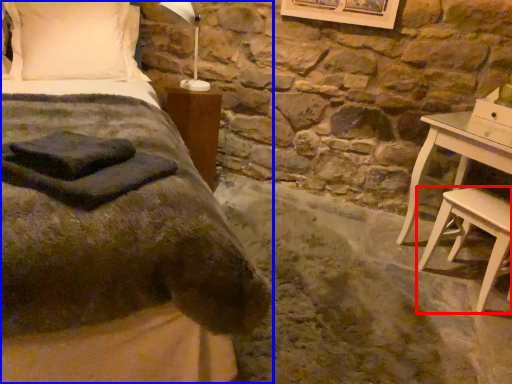
Question: Which object is closer to the camera taking this photo, stool (highlighted by a red box) or bed (highlighted by a blue box)?

Choices:
 (A) stool
 (B) bed

Answer: (B)